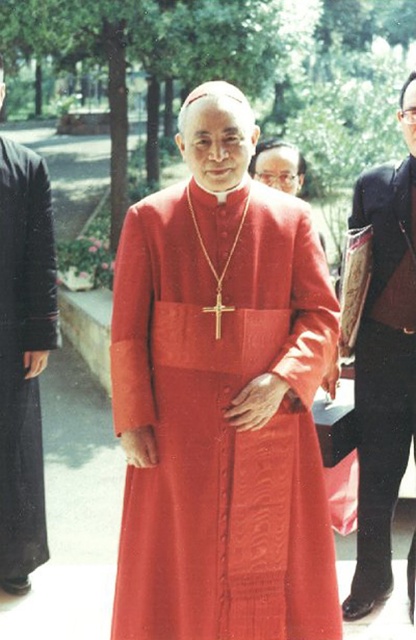
You are a photographer standing 3 meters away from the camera. You want to take a photo of the matte red robe at center. Can you reach it with your camera if you move forward 0.5 meters?

The matte red robe at center is 2.49 meters from camera. If you move forward 0.5 meters from your current position 3 meters away, you will be 2.5 meters away, which is just beyond the robe. You need to move back slightly to ensure the robe is in focus.

You are a photographer trying to capture a group photo of the matte red robe at center and the other person on the right side holding a book or folder. If the minimum distance required for your camera to focus properly is 8 feet, will you be able to take the photo without moving either subject?

The matte red robe at center and the other person on the right side holding a book or folder are 8.17 feet apart, which is more than the 8 feet minimum distance required for the camera to focus properly. Therefore, you can take the photo without moving either subject.